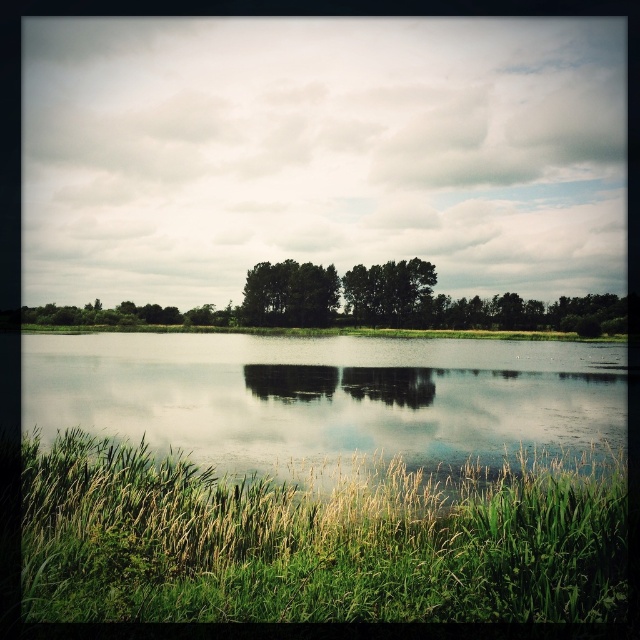
You are a photographer planning to capture a landscape photo that includes both the green grassy at lower left and the green matte tree at center. Which object will appear narrower in the photo?

The green grassy at lower left will appear narrower in the photo because it is thinner than the green matte tree at center.

You are standing in the serene landscape and want to walk towards the green matte trees at center and the green matte tree at center. Which one will you reach first?

You will reach the green matte trees at center first because it is closer to you than the green matte tree at center, which is further away.

You are standing in a serene natural landscape with a calm body of water reflecting the overcast sky. You see a point marked at coordinates (289, 294). What object is located at that point?

The point at coordinates (289, 294) indicates green matte trees at center.